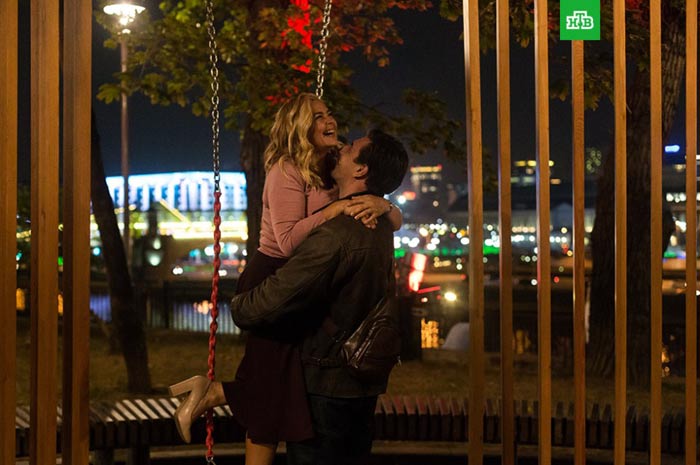
Where is `blinds`? blinds is located at coordinates (505, 332).